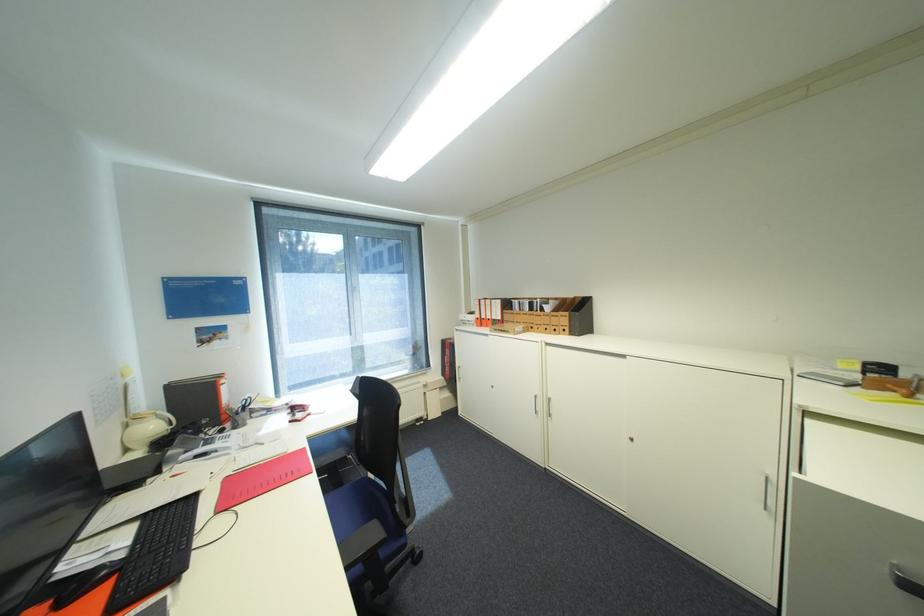
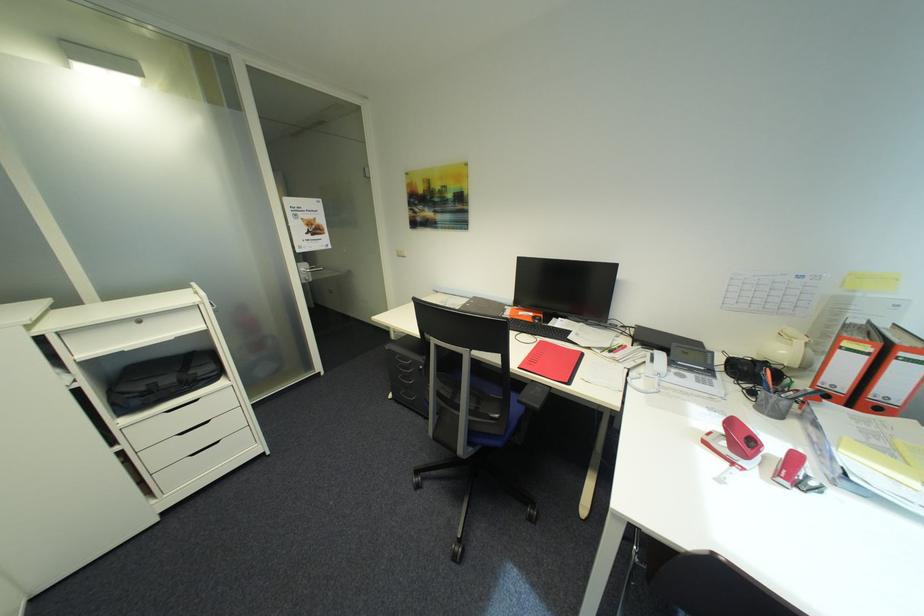
In the second image, find the point that corresponds to point 317,415 in the first image.

(742, 464)